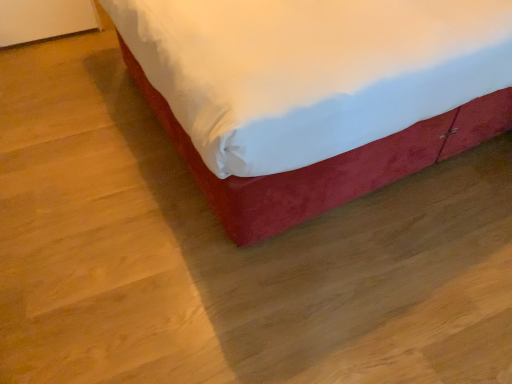
Identify the location of velvet red bed at center. The image size is (512, 384). (326, 162).

What do you see at coordinates (326, 162) in the screenshot? I see `velvet red bed at center` at bounding box center [326, 162].

Identify the location of velvet red bed at center. Image resolution: width=512 pixels, height=384 pixels. (326, 162).